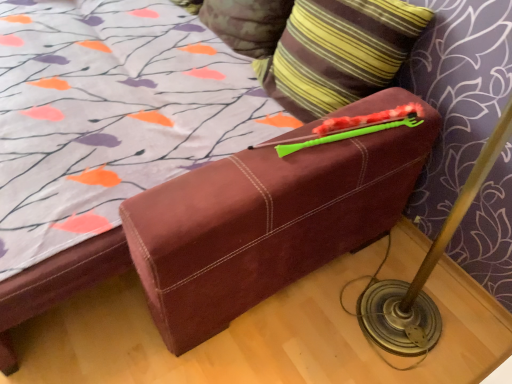
Question: Which direction should I rotate to face striped fabric pillow at upper center, the second pillow when ordered from front to back, — up or down?

Choices:
 (A) up
 (B) down

Answer: (A)

Question: Considering the relative sizes of striped fabric pillow at upper center, placed as the 1th pillow when sorted from back to front, and striped fabric pillow at upper right, marked as the 2th pillow in a back-to-front arrangement, in the image provided, is striped fabric pillow at upper center, placed as the 1th pillow when sorted from back to front, shorter than striped fabric pillow at upper right, marked as the 2th pillow in a back-to-front arrangement,?

Choices:
 (A) no
 (B) yes

Answer: (B)

Question: Is striped fabric pillow at upper center, the second pillow when ordered from front to back, to the left of striped fabric pillow at upper right, marked as the 2th pillow in a back-to-front arrangement, from the viewer's perspective?

Choices:
 (A) no
 (B) yes

Answer: (B)

Question: Is striped fabric pillow at upper center, the second pillow when ordered from front to back, in front of striped fabric pillow at upper right, marked as the 2th pillow in a back-to-front arrangement?

Choices:
 (A) no
 (B) yes

Answer: (A)

Question: Is striped fabric pillow at upper right, arranged as the 1th pillow when viewed from the front, at the back of striped fabric pillow at upper center, the second pillow when ordered from front to back?

Choices:
 (A) yes
 (B) no

Answer: (B)

Question: From the image's perspective, is striped fabric pillow at upper center, placed as the 1th pillow when sorted from back to front, below striped fabric pillow at upper right, marked as the 2th pillow in a back-to-front arrangement?

Choices:
 (A) no
 (B) yes

Answer: (A)

Question: Could striped fabric pillow at upper right, arranged as the 1th pillow when viewed from the front, be considered to be inside striped fabric pillow at upper center, placed as the 1th pillow when sorted from back to front?

Choices:
 (A) no
 (B) yes

Answer: (A)

Question: Would you consider striped fabric pillow at upper right, arranged as the 1th pillow when viewed from the front, to be distant from striped fabric pillow at upper center, the second pillow when ordered from front to back?

Choices:
 (A) yes
 (B) no

Answer: (B)

Question: Can you see striped fabric pillow at upper right, arranged as the 1th pillow when viewed from the front, touching striped fabric pillow at upper center, placed as the 1th pillow when sorted from back to front?

Choices:
 (A) yes
 (B) no

Answer: (B)

Question: Can you confirm if striped fabric pillow at upper right, arranged as the 1th pillow when viewed from the front, is shorter than striped fabric pillow at upper center, placed as the 1th pillow when sorted from back to front?

Choices:
 (A) no
 (B) yes

Answer: (A)

Question: Is striped fabric pillow at upper right, arranged as the 1th pillow when viewed from the front, positioned beyond the bounds of striped fabric pillow at upper center, the second pillow when ordered from front to back?

Choices:
 (A) no
 (B) yes

Answer: (B)

Question: Is the depth of striped fabric pillow at upper right, arranged as the 1th pillow when viewed from the front, less than that of striped fabric pillow at upper center, the second pillow when ordered from front to back?

Choices:
 (A) no
 (B) yes

Answer: (B)

Question: From a real-world perspective, is striped fabric pillow at upper right, marked as the 2th pillow in a back-to-front arrangement, on striped fabric pillow at upper center, the second pillow when ordered from front to back?

Choices:
 (A) yes
 (B) no

Answer: (A)

Question: From a real-world perspective, is striped fabric pillow at upper center, the second pillow when ordered from front to back, positioned above or below striped fabric pillow at upper right, arranged as the 1th pillow when viewed from the front?

Choices:
 (A) above
 (B) below

Answer: (B)